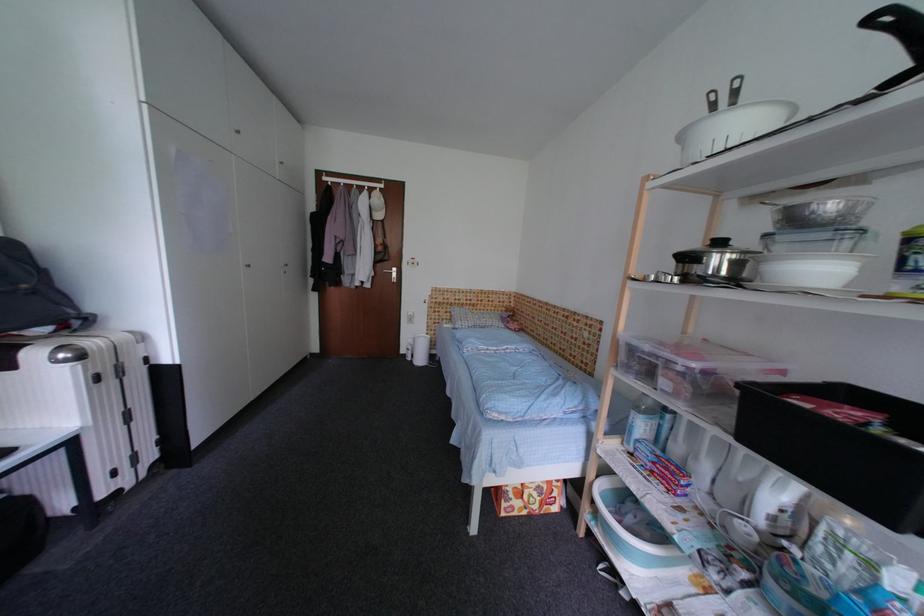
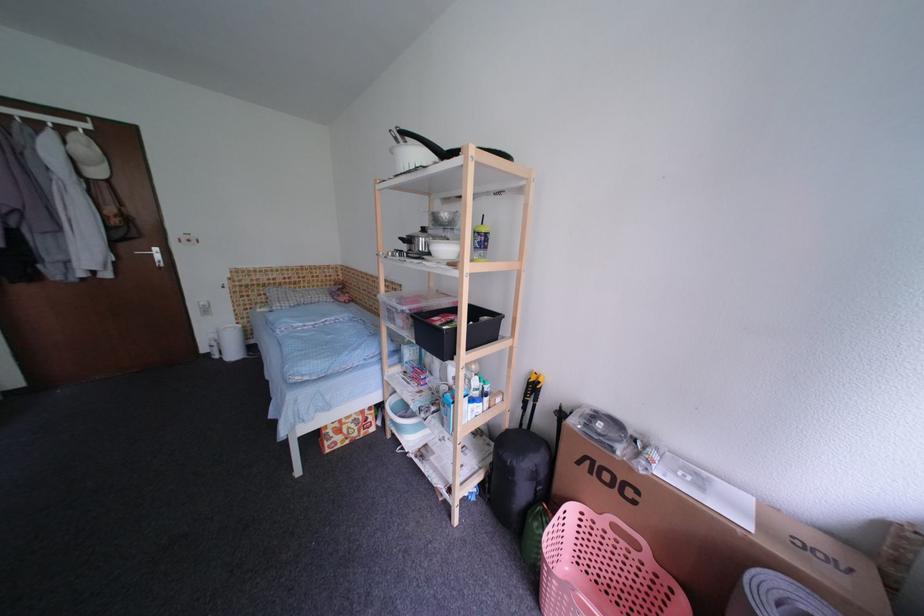
In the second image, find the point that corresponds to [839,209] in the first image.

(453, 217)